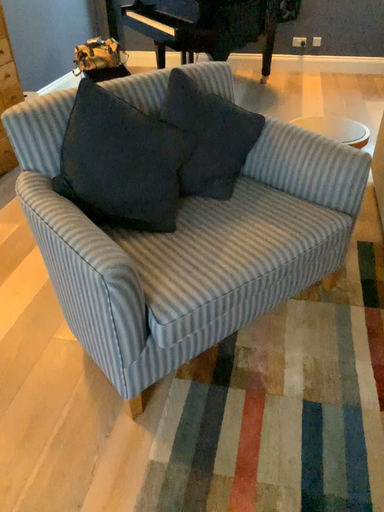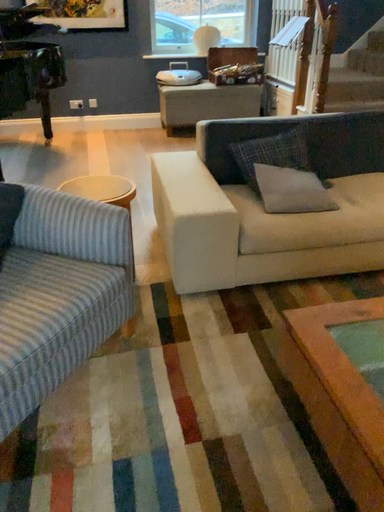
Question: How did the camera likely rotate when shooting the video?

Choices:
 (A) rotated right
 (B) rotated left

Answer: (A)